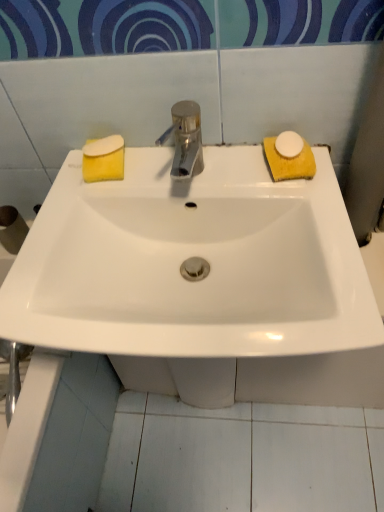
Describe the element at coordinates (191, 256) in the screenshot. I see `white glossy sink at center` at that location.

Find the location of `yellow sponge at left, the 3th soap in the right-to-left sequence`. yellow sponge at left, the 3th soap in the right-to-left sequence is located at coordinates (103, 159).

Where is `white matte soap at right, the 2th soap when ordered from right to left`? white matte soap at right, the 2th soap when ordered from right to left is located at coordinates (289, 144).

Where is `white glossy sink at center`? The image size is (384, 512). white glossy sink at center is located at coordinates (191, 256).

Does white glossy sink at center appear on the left side of polished metallic tap at center?

No, white glossy sink at center is not to the left of polished metallic tap at center.

Considering the sizes of white glossy sink at center and polished metallic tap at center in the image, is white glossy sink at center wider or thinner than polished metallic tap at center?

white glossy sink at center is wider than polished metallic tap at center.

Is white glossy sink at center directly adjacent to polished metallic tap at center?

No, white glossy sink at center is not next to polished metallic tap at center.

Is white glossy sink at center oriented towards yellow sponge at left, the 1th soap in the left-to-right sequence?

No, white glossy sink at center is not aimed at yellow sponge at left, the 1th soap in the left-to-right sequence.

From the image's perspective, is white glossy sink at center above or below yellow sponge at left, the 3th soap in the right-to-left sequence?

Based on their image positions, white glossy sink at center is located beneath yellow sponge at left, the 3th soap in the right-to-left sequence.

Is white glossy sink at center completely or partially outside of yellow sponge at left, the 1th soap in the left-to-right sequence?

Absolutely, white glossy sink at center is external to yellow sponge at left, the 1th soap in the left-to-right sequence.

The height and width of the screenshot is (512, 384). I want to click on soap that appears on the left of white glossy sink at center, so click(103, 159).

Consider the image. Does polished metallic tap at center turn towards yellow sponge at left, the 3th soap in the right-to-left sequence?

No, polished metallic tap at center is not facing towards yellow sponge at left, the 3th soap in the right-to-left sequence.

Which is nearer, (x=172, y=168) or (x=114, y=157)?

Positioned in front is point (x=114, y=157).

What's the angular difference between polished metallic tap at center and yellow sponge at left, the 1th soap in the left-to-right sequence,'s facing directions?

polished metallic tap at center and yellow sponge at left, the 1th soap in the left-to-right sequence, are facing 7.8 degrees away from each other.

Which of these two, polished metallic tap at center or yellow sponge at left, the 3th soap in the right-to-left sequence, stands taller?

polished metallic tap at center is taller.

How distant is white matte soap at right, the 2th soap positioned from the left, from polished metallic tap at center?

white matte soap at right, the 2th soap positioned from the left, is 6.86 inches away from polished metallic tap at center.

Considering the relative positions of white matte soap at right, the 2th soap positioned from the left, and polished metallic tap at center in the image provided, is white matte soap at right, the 2th soap positioned from the left, to the left of polished metallic tap at center from the viewer's perspective?

No, white matte soap at right, the 2th soap positioned from the left, is not to the left of polished metallic tap at center.

Is white matte soap at right, the 2th soap positioned from the left, in front of or behind polished metallic tap at center in the image?

white matte soap at right, the 2th soap positioned from the left, is positioned farther from the viewer than polished metallic tap at center.

Who is bigger, white matte soap at right, the 2th soap positioned from the left, or polished metallic tap at center?

polished metallic tap at center is bigger.

Would you say white matte soap at right, the 2th soap when ordered from right to left, is outside yellow sponge at left, the 3th soap in the right-to-left sequence?

Yes, white matte soap at right, the 2th soap when ordered from right to left, is outside of yellow sponge at left, the 3th soap in the right-to-left sequence.

Can you tell me how much white matte soap at right, the 2th soap positioned from the left, and yellow sponge at left, the 1th soap in the left-to-right sequence, differ in facing direction?

The angular difference between white matte soap at right, the 2th soap positioned from the left, and yellow sponge at left, the 1th soap in the left-to-right sequence, is 1.05 degrees.

Between white matte soap at right, the 2th soap positioned from the left, and yellow sponge at left, the 1th soap in the left-to-right sequence, which one has smaller size?

white matte soap at right, the 2th soap positioned from the left, is smaller.

From a real-world perspective, between white matte soap at right, the 2th soap when ordered from right to left, and yellow sponge at left, the 3th soap in the right-to-left sequence, who is vertically lower?

yellow sponge at left, the 3th soap in the right-to-left sequence, is physically lower.

In the image, is white glossy sink at center positioned in front of or behind white matte soap at right, the 2th soap positioned from the left?

white glossy sink at center is positioned closer to the viewer than white matte soap at right, the 2th soap positioned from the left.

Is white glossy sink at center with white matte soap at right, the 2th soap positioned from the left?

No, white glossy sink at center is not making contact with white matte soap at right, the 2th soap positioned from the left.

Where is `sink in front of the white matte soap at right, the 2th soap when ordered from right to left`? The width and height of the screenshot is (384, 512). sink in front of the white matte soap at right, the 2th soap when ordered from right to left is located at coordinates (191, 256).

Which of these two, white matte soap at right, arranged as the third soap when viewed from the left, or white glossy sink at center, is bigger?

Bigger between the two is white glossy sink at center.

From the image's perspective, which one is positioned lower, white matte soap at right, the 1th soap from the right, or white glossy sink at center?

From the image's view, white glossy sink at center is below.

Is white matte soap at right, arranged as the third soap when viewed from the left, taller than white glossy sink at center?

Incorrect, the height of white matte soap at right, arranged as the third soap when viewed from the left, is not larger of that of white glossy sink at center.

The height and width of the screenshot is (512, 384). Find the location of `tap above the white glossy sink at center (from the image's perspective)`. tap above the white glossy sink at center (from the image's perspective) is located at coordinates (185, 139).

Locate an element on the screen. sink on the right side of yellow sponge at left, the 3th soap in the right-to-left sequence is located at coordinates (191, 256).

Looking at this image, estimate the real-world distances between objects in this image. Which object is closer to white matte soap at right, arranged as the third soap when viewed from the left, white glossy sink at center or white matte soap at right, the 2th soap when ordered from right to left?

Based on the image, white matte soap at right, the 2th soap when ordered from right to left, appears to be nearer to white matte soap at right, arranged as the third soap when viewed from the left.

Estimate the real-world distances between objects in this image. Which object is further from yellow sponge at left, the 3th soap in the right-to-left sequence, white glossy sink at center or white matte soap at right, the 2th soap positioned from the left?

Based on the image, white matte soap at right, the 2th soap positioned from the left, appears to be further to yellow sponge at left, the 3th soap in the right-to-left sequence.

When comparing their distances from white glossy sink at center, does white matte soap at right, the 2th soap when ordered from right to left, or white matte soap at right, the 1th soap from the right, seem closer?

Among the two, white matte soap at right, the 1th soap from the right, is located nearer to white glossy sink at center.

Looking at the image, which one is located further to white glossy sink at center, yellow sponge at left, the 1th soap in the left-to-right sequence, or polished metallic tap at center?

yellow sponge at left, the 1th soap in the left-to-right sequence, is positioned further to the anchor white glossy sink at center.

Based on their spatial positions, is white matte soap at right, the 2th soap positioned from the left, or yellow sponge at left, the 3th soap in the right-to-left sequence, further from polished metallic tap at center?

Based on the image, white matte soap at right, the 2th soap positioned from the left, appears to be further to polished metallic tap at center.

From the image, which object appears to be nearer to white glossy sink at center, white matte soap at right, the 1th soap from the right, or yellow sponge at left, the 1th soap in the left-to-right sequence?

Among the two, yellow sponge at left, the 1th soap in the left-to-right sequence, is located nearer to white glossy sink at center.

When comparing their distances from white glossy sink at center, does polished metallic tap at center or yellow sponge at left, the 1th soap in the left-to-right sequence, seem closer?

Among the two, polished metallic tap at center is located nearer to white glossy sink at center.

Which object lies nearer to the anchor point white matte soap at right, the 2th soap positioned from the left, white glossy sink at center or white matte soap at right, the 1th soap from the right?

white matte soap at right, the 1th soap from the right, is positioned closer to the anchor white matte soap at right, the 2th soap positioned from the left.

Find the location of a particular element. The image size is (384, 512). soap between polished metallic tap at center and white matte soap at right, arranged as the third soap when viewed from the left, in the horizontal direction is located at coordinates (289, 144).

You are a GUI agent. You are given a task and a screenshot of the screen. Output one action in this format:
    pyautogui.click(x=<x>, y=<y>)
    Task: Click on the tap positioned between white glossy sink at center and yellow sponge at left, the 3th soap in the right-to-left sequence, from near to far
    The height and width of the screenshot is (512, 384).
    Given the screenshot: What is the action you would take?
    pyautogui.click(x=185, y=139)

Locate an element on the screen. sink located between polished metallic tap at center and white matte soap at right, arranged as the third soap when viewed from the left, in the left-right direction is located at coordinates (191, 256).

Where is `tap between white matte soap at right, the 2th soap when ordered from right to left, and white glossy sink at center from top to bottom`? This screenshot has width=384, height=512. tap between white matte soap at right, the 2th soap when ordered from right to left, and white glossy sink at center from top to bottom is located at coordinates (185, 139).